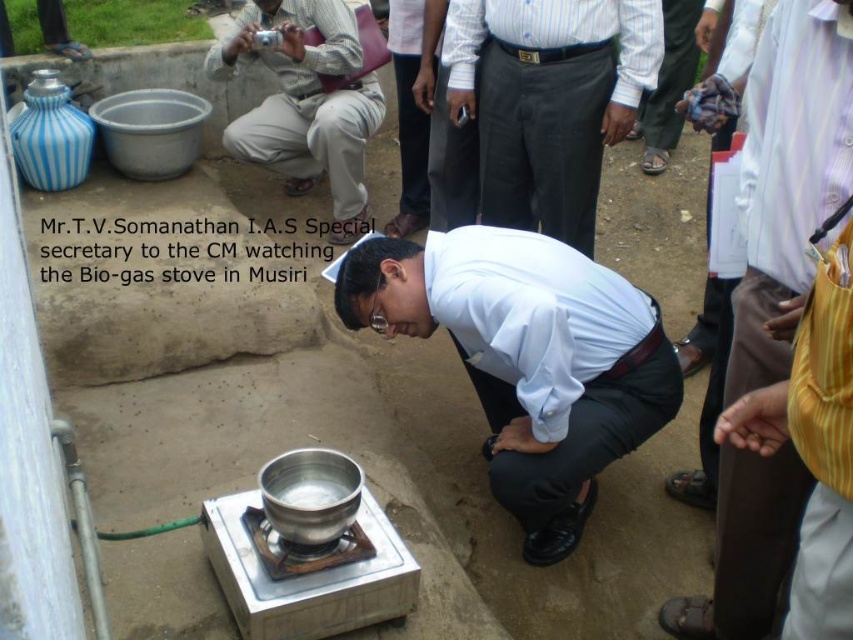
Question: Does shiny metallic pot at center appear on the right side of white striped shirt at center?

Choices:
 (A) yes
 (B) no

Answer: (B)

Question: Can you confirm if shiny metallic pot at center is smaller than matte silver camera at upper left?

Choices:
 (A) no
 (B) yes

Answer: (A)

Question: Does white striped shirt at center appear on the left side of matte silver camera at upper left?

Choices:
 (A) no
 (B) yes

Answer: (A)

Question: Among these objects, which one is farthest from the camera?

Choices:
 (A) white striped shirt at center
 (B) shiny metallic pot at center

Answer: (A)

Question: Which object is farther from the camera taking this photo?

Choices:
 (A) shiny metallic pot at center
 (B) white striped shirt at center

Answer: (B)

Question: Which object appears farthest from the camera in this image?

Choices:
 (A) matte silver camera at upper left
 (B) white striped shirt at center

Answer: (A)